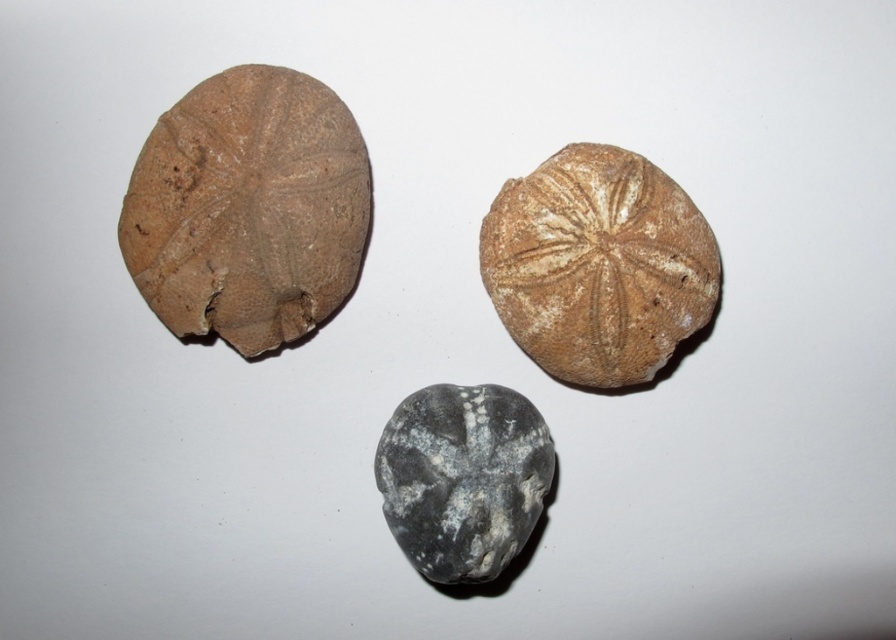
You are standing at the origin point in the image. Which of the two points, point (604, 216) or point (418, 545), is farther away from you?

Point (604, 216) is behind point (418, 545), so it is farther away from you.

Where is the brown fossilized shell at upper left located in the image?

The brown fossilized shell at upper left is located at point [248,209] in the image.